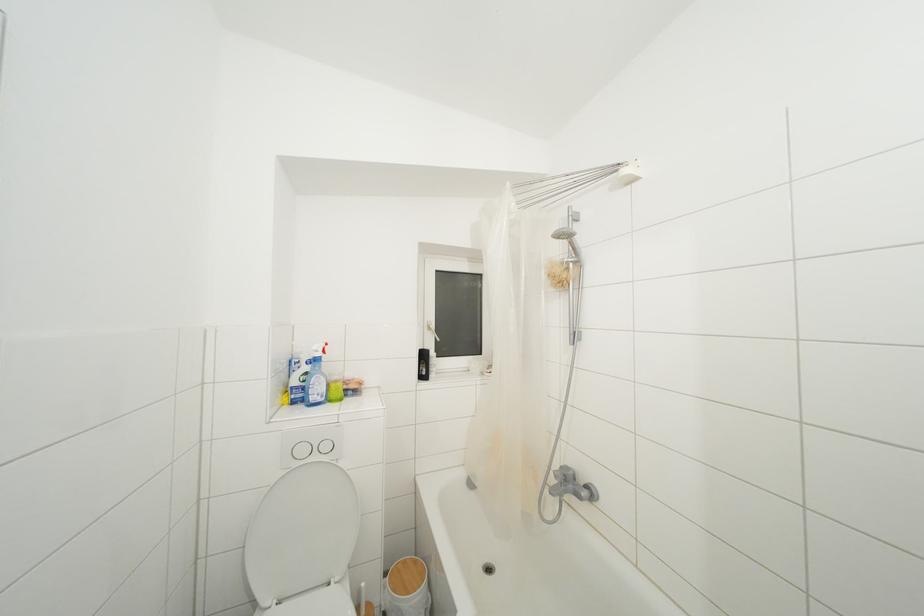
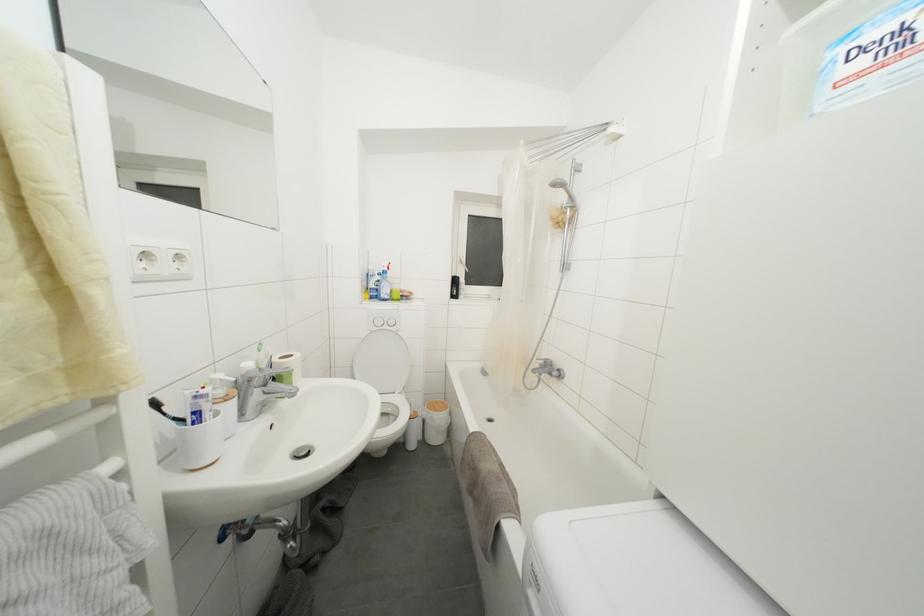
The point at (320, 463) is marked in the first image. Where is the corresponding point in the second image?

(390, 331)